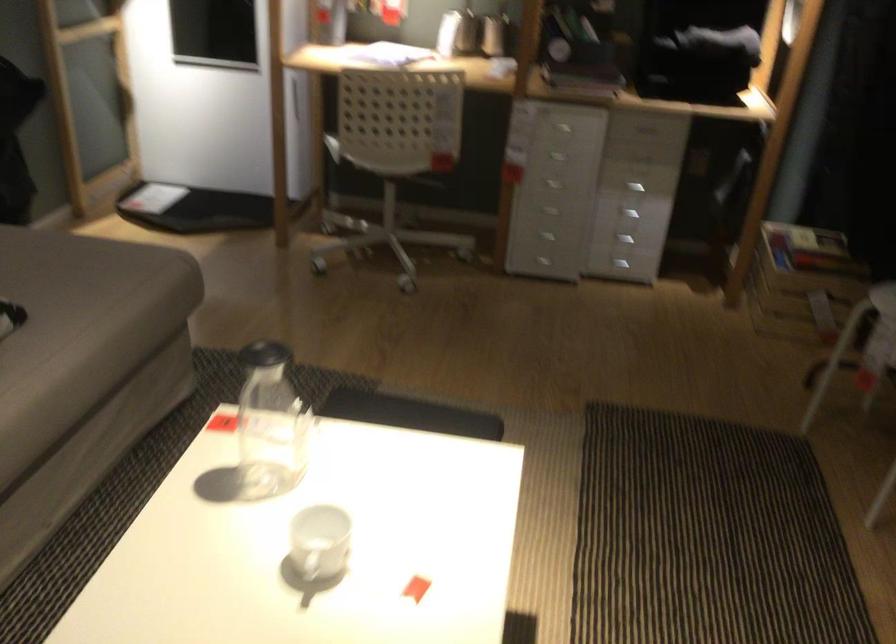
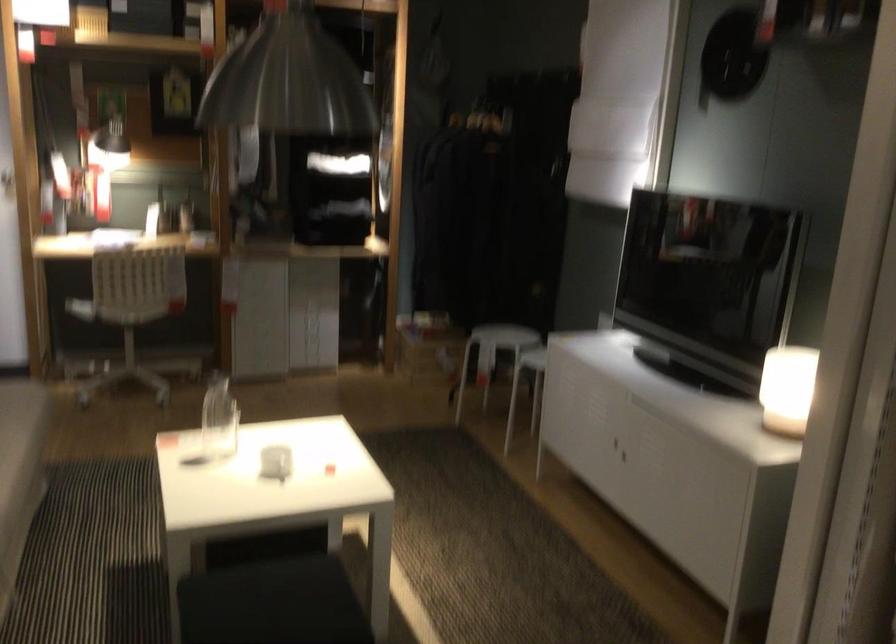
In the second image, find the point that corresponds to point 264,354 in the first image.

(224, 383)